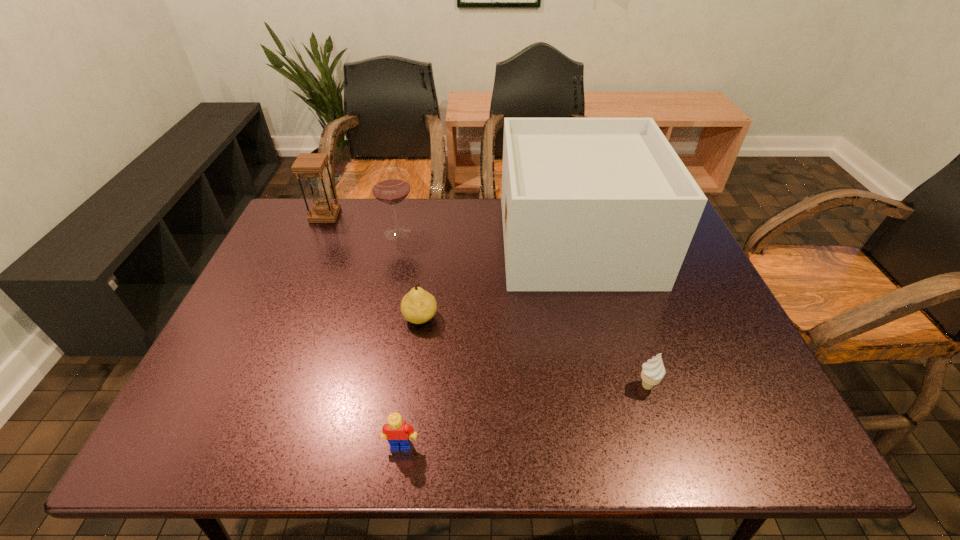
In order to click on object located in the far right corner section of the desktop in this screenshot , I will do `click(588, 204)`.

I want to click on vacant space at the far edge of the desktop, so click(373, 212).

In order to click on vacant area at the left edge in this screenshot , I will do `click(192, 399)`.

Image resolution: width=960 pixels, height=540 pixels. Identify the location of free space at the right edge of the desktop. (689, 268).

In the image, there is a desktop. Identify the location of blank space at the far left corner. This screenshot has height=540, width=960. (315, 235).

In the image, there is a desktop. What are the coordinates of `vacant space at the near right corner` in the screenshot? It's located at (721, 418).

You are a GUI agent. You are given a task and a screenshot of the screen. Output one action in this format:
    pyautogui.click(x=<x>, y=<y>)
    Task: Click on the free spot between the tallest object and the hourglass
    The height and width of the screenshot is (540, 960).
    Given the screenshot: What is the action you would take?
    pyautogui.click(x=450, y=228)

This screenshot has width=960, height=540. I want to click on vacant space that's between the nearest object and the second object from left to right, so click(x=399, y=339).

Locate an element on the screen. The width and height of the screenshot is (960, 540). free space between the tallest object and the second nearest object is located at coordinates (612, 313).

Identify the location of free space between the fifth object from right to left and the icecream. The height and width of the screenshot is (540, 960). (522, 309).